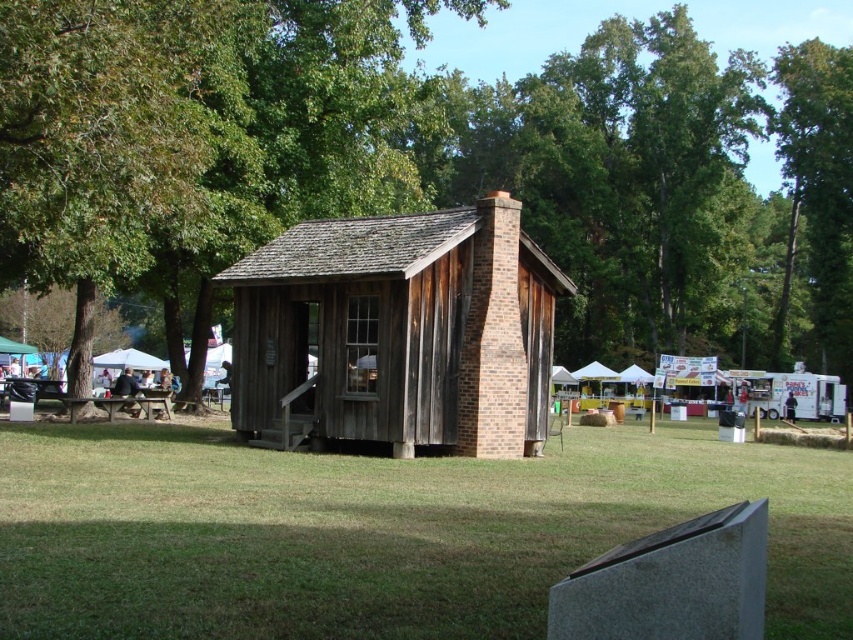
Question: Which object is positioned farthest from the green leafy tree at upper right?

Choices:
 (A) green grass at center
 (B) wooden cabin at center
 (C) brown wooden picnic table at lower left

Answer: (C)

Question: Among these objects, which one is nearest to the camera?

Choices:
 (A) wooden cabin at center
 (B) green grass at center
 (C) brown wooden picnic table at lower left
 (D) green leafy tree at upper right

Answer: (B)

Question: Does green leafy tree at center have a larger size compared to green grass at center?

Choices:
 (A) yes
 (B) no

Answer: (A)

Question: Among these points, which one is farthest from the camera?

Choices:
 (A) (846, 208)
 (B) (477, 301)
 (C) (846, 154)

Answer: (A)

Question: Is green leafy tree at center thinner than wooden cabin at center?

Choices:
 (A) no
 (B) yes

Answer: (A)

Question: Can you confirm if wooden cabin at center is wider than green leafy tree at upper right?

Choices:
 (A) yes
 (B) no

Answer: (B)